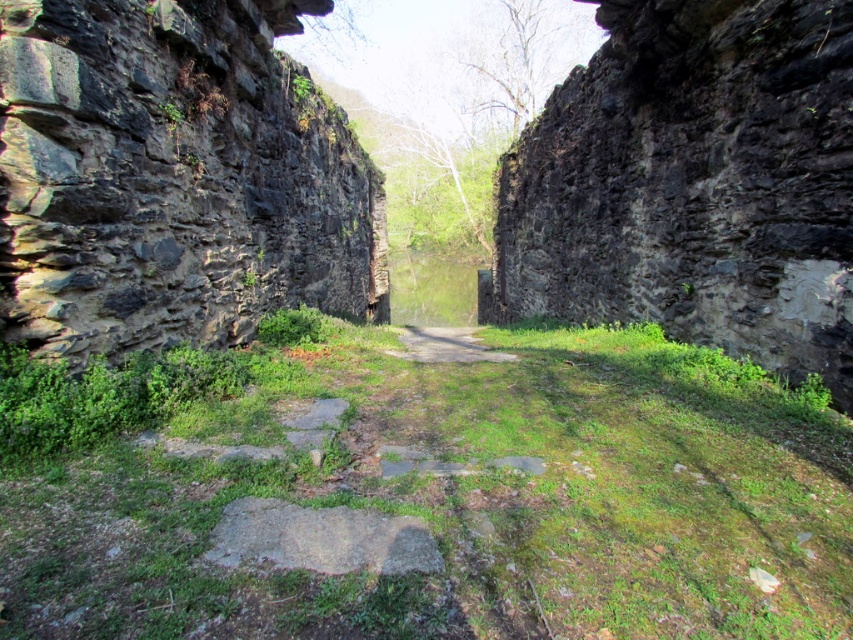
Question: Is gray rough stone at center below dirt path at center?

Choices:
 (A) no
 (B) yes

Answer: (B)

Question: Does dark gray rough stone at left have a greater width compared to rough stone wall at right?

Choices:
 (A) no
 (B) yes

Answer: (A)

Question: Does rough stone wall at right lie behind gray rough stone at center?

Choices:
 (A) yes
 (B) no

Answer: (A)

Question: Which object is farther from the camera taking this photo?

Choices:
 (A) gray rough stone at center
 (B) dirt path at center
 (C) dark gray rough stone at left
 (D) rough stone wall at right

Answer: (B)

Question: Which object is positioned farthest from the dirt path at center?

Choices:
 (A) gray rough stone at center
 (B) rough stone wall at right

Answer: (A)

Question: Among these objects, which one is nearest to the camera?

Choices:
 (A) rough stone wall at right
 (B) gray rough stone at center

Answer: (B)